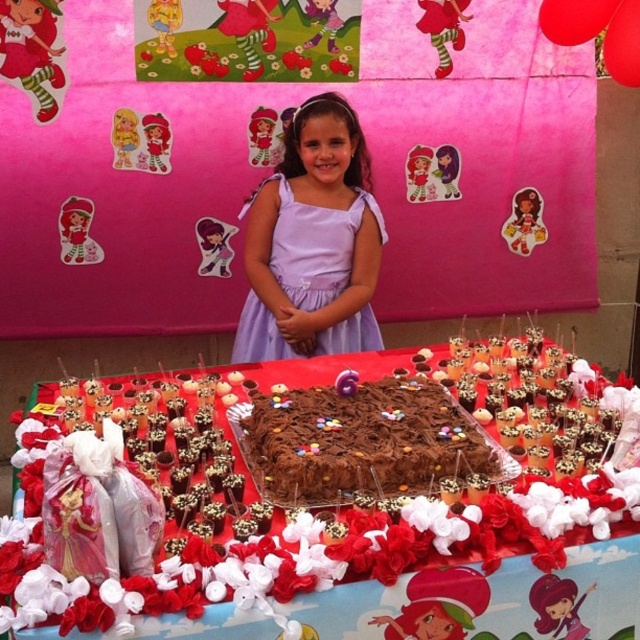
Is chocolate cake at center below chocolatesmoothcake at center?

Yes, chocolate cake at center is below chocolatesmoothcake at center.

Can you confirm if chocolate cake at center is wider than chocolatesmoothcake at center?

Correct, the width of chocolate cake at center exceeds that of chocolatesmoothcake at center.

At what (x,y) coordinates should I click in order to perform the action: click on chocolate cake at center. Please return your answer as a coordinate pair (x, y). Looking at the image, I should click on (333, 512).

Who is shorter, chocolatesmoothcake at center or lavender satin dress at center?

With less height is chocolatesmoothcake at center.

Does chocolatesmoothcake at center have a lesser height compared to lavender satin dress at center?

Indeed, chocolatesmoothcake at center has a lesser height compared to lavender satin dress at center.

Describe the element at coordinates (360, 442) in the screenshot. I see `chocolatesmoothcake at center` at that location.

Find the location of a particular element. chocolatesmoothcake at center is located at coordinates (360, 442).

Looking at this image, is chocolate cake at center wider than lavender satin dress at center?

Yes, chocolate cake at center is wider than lavender satin dress at center.

Is chocolate cake at center taller than lavender satin dress at center?

In fact, chocolate cake at center may be shorter than lavender satin dress at center.

Locate an element on the screen. chocolate cake at center is located at coordinates (333, 512).